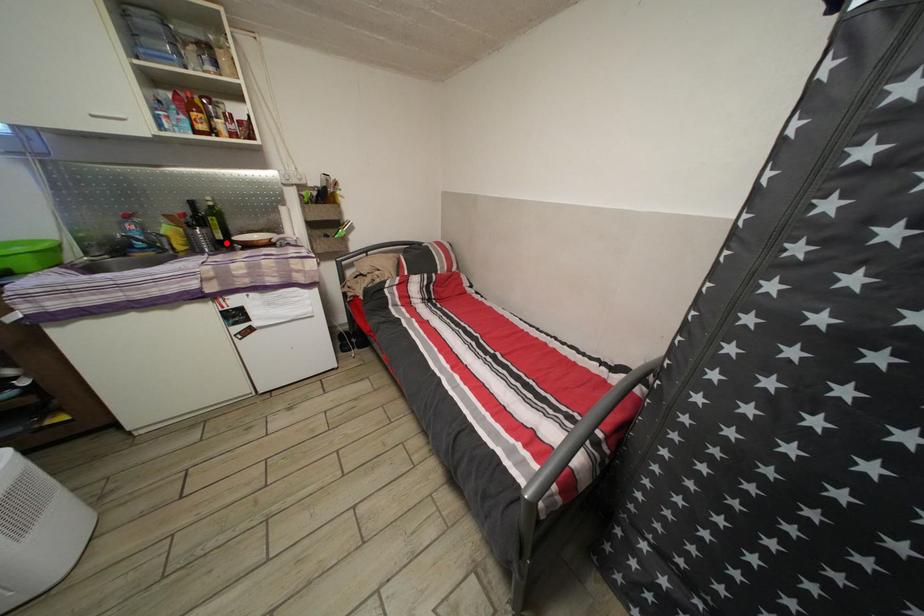
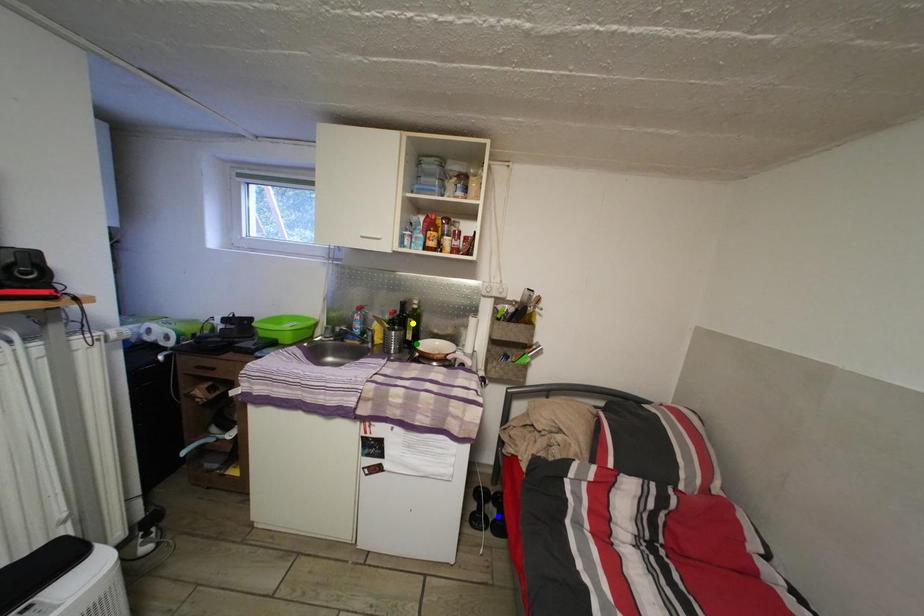
Question: I am providing you with two images of the same scene from different viewpoints. A red point is marked on the first image. You are given multiple points on the second image. Which point in image 2 is actually the same real-world point as the red point in image 1?

Choices:
 (A) green point
 (B) blue point
 (C) yellow point

Answer: (A)